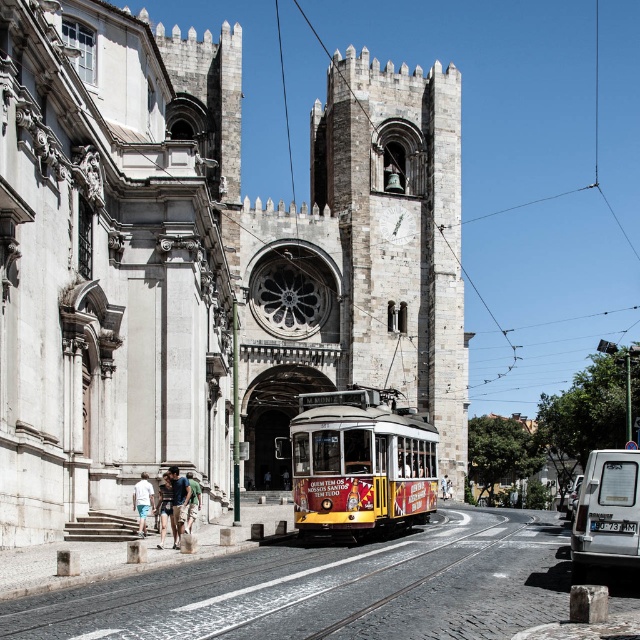
Looking at this image, can you confirm if stone church at center is taller than white cotton shorts at lower left?

Correct, stone church at center is much taller as white cotton shorts at lower left.

Who is lower down, stone church at center or white cotton shorts at lower left?

white cotton shorts at lower left is lower down.

At what (x,y) coordinates should I click in order to perform the action: click on stone church at center. Please return your answer as a coordinate pair (x, y). This screenshot has width=640, height=640. Looking at the image, I should click on tap(209, 266).

Does white matte van at lower right appear on the right side of light brown leather jacket at center?

Indeed, white matte van at lower right is positioned on the right side of light brown leather jacket at center.

Is point (600, 554) behind point (189, 515)?

No, it is not.

Is point (577, 506) farther from viewer compared to point (188, 502)?

No, it is in front of (188, 502).

Find the location of a particular element. This screenshot has height=640, width=640. white matte van at lower right is located at coordinates (605, 513).

Does point (336, 99) come in front of point (147, 474)?

No, (336, 99) is behind (147, 474).

You are a GUI agent. You are given a task and a screenshot of the screen. Output one action in this format:
    pyautogui.click(x=<x>, y=<y>)
    Task: Click on the gray stone tower at center
    The width and height of the screenshot is (640, 640).
    Given the screenshot: What is the action you would take?
    pyautogui.click(x=358, y=262)